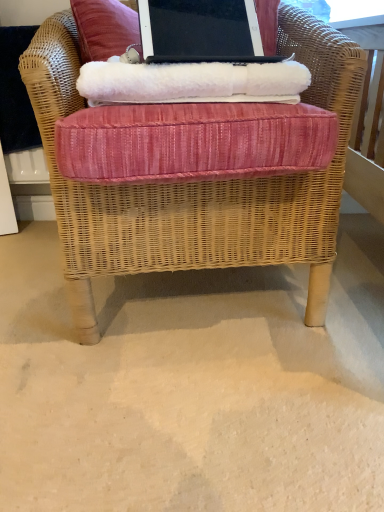
Question: Is woven wicker chair at center wider or thinner than white fluffy blanket at upper center?

Choices:
 (A) thin
 (B) wide

Answer: (B)

Question: Would you say woven wicker chair at center is to the left or to the right of white fluffy blanket at upper center in the picture?

Choices:
 (A) left
 (B) right

Answer: (A)

Question: Estimate the real-world distances between objects in this image. Which object is closer to the black matte laptop at upper center?

Choices:
 (A) white fluffy blanket at upper center
 (B) woven wicker chair at center

Answer: (B)

Question: Which object is the farthest from the white fluffy blanket at upper center?

Choices:
 (A) woven wicker chair at center
 (B) black matte laptop at upper center

Answer: (B)